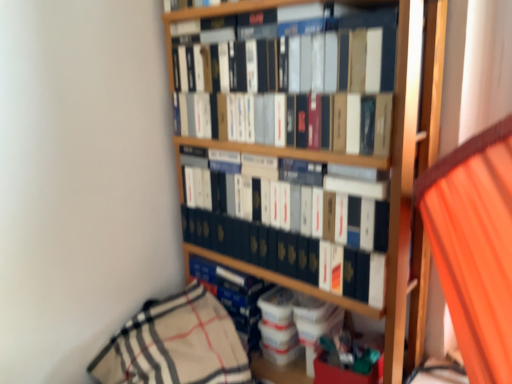
Question: From the image's perspective, is matte black book at upper center, the 3th book in the bottom-to-top sequence, located beneath matte black book at center, the 2th book from the bottom?

Choices:
 (A) no
 (B) yes

Answer: (A)

Question: Would you say matte black book at upper center, the 3th book in the bottom-to-top sequence, is outside matte black book at center, the 2th book from the bottom?

Choices:
 (A) yes
 (B) no

Answer: (A)

Question: Is matte black book at upper center, the 3th book in the bottom-to-top sequence, far from matte black book at center, the 2th book from the bottom?

Choices:
 (A) no
 (B) yes

Answer: (A)

Question: Are matte black book at upper center, the 3th book in the bottom-to-top sequence, and matte black book at center, the 2th book from the bottom, making contact?

Choices:
 (A) yes
 (B) no

Answer: (B)

Question: Does matte black book at upper center, the 3th book in the bottom-to-top sequence, lie behind matte black book at center, the 2th book from the bottom?

Choices:
 (A) no
 (B) yes

Answer: (A)

Question: Based on their sizes in the image, would you say matte black book at center, which is the 2th book in top-to-bottom order, is bigger or smaller than blue hardcover book at center, which appears as the 1th book when ordered from the bottom?

Choices:
 (A) big
 (B) small

Answer: (A)

Question: Considering the positions of matte black book at center, the 2th book from the bottom, and blue hardcover book at center, the 3th book from the top, in the image, is matte black book at center, the 2th book from the bottom, wider or thinner than blue hardcover book at center, the 3th book from the top,?

Choices:
 (A) thin
 (B) wide

Answer: (A)

Question: Choose the correct answer: Is matte black book at center, which is the 2th book in top-to-bottom order, inside blue hardcover book at center, which appears as the 1th book when ordered from the bottom, or outside it?

Choices:
 (A) outside
 (B) inside

Answer: (A)

Question: In the image, is matte black book at center, which is the 2th book in top-to-bottom order, on the left side or the right side of blue hardcover book at center, the 3th book from the top?

Choices:
 (A) left
 (B) right

Answer: (B)

Question: From the image's perspective, is matte black book at upper center, which appears as the 1th book when viewed from the top, above or below blue hardcover book at center, which appears as the 1th book when ordered from the bottom?

Choices:
 (A) above
 (B) below

Answer: (A)

Question: In terms of height, does matte black book at upper center, the 3th book in the bottom-to-top sequence, look taller or shorter compared to blue hardcover book at center, the 3th book from the top?

Choices:
 (A) short
 (B) tall

Answer: (B)

Question: Considering the positions of matte black book at upper center, the 3th book in the bottom-to-top sequence, and blue hardcover book at center, the 3th book from the top, in the image, is matte black book at upper center, the 3th book in the bottom-to-top sequence, bigger or smaller than blue hardcover book at center, the 3th book from the top,?

Choices:
 (A) small
 (B) big

Answer: (B)

Question: Is point (371, 92) positioned closer to the camera than point (202, 261)?

Choices:
 (A) farther
 (B) closer

Answer: (B)

Question: Would you say blue hardcover book at center, the 3th book from the top, is inside or outside matte black book at upper center, which appears as the 1th book when viewed from the top?

Choices:
 (A) outside
 (B) inside

Answer: (A)

Question: From the image's perspective, is blue hardcover book at center, the 3th book from the top, positioned above or below matte black book at upper center, which appears as the 1th book when viewed from the top?

Choices:
 (A) below
 (B) above

Answer: (A)